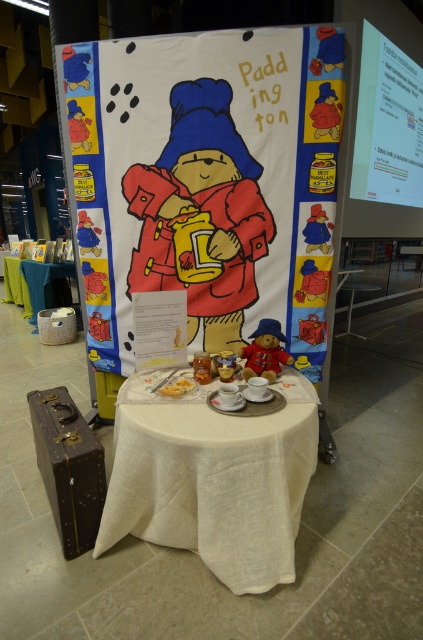
Question: Which of the following is the closest to the observer?

Choices:
 (A) (96, 138)
 (B) (82, 472)

Answer: (B)

Question: Can you confirm if leather suitcase at lower left is bigger than yellow matte cake at center?

Choices:
 (A) no
 (B) yes

Answer: (B)

Question: Which of the following is the closest to the observer?

Choices:
 (A) leather suitcase at lower left
 (B) yellow matte cake at center
 (C) white linen table at center

Answer: (C)

Question: Considering the relative positions of white linen table at center and leather suitcase at lower left in the image provided, where is white linen table at center located with respect to leather suitcase at lower left?

Choices:
 (A) above
 (B) below

Answer: (A)

Question: Can you confirm if white linen table at center is thinner than white fabric table at lower left?

Choices:
 (A) yes
 (B) no

Answer: (A)

Question: Which object appears closest to the camera in this image?

Choices:
 (A) white fabric table at lower left
 (B) yellow matte cake at center
 (C) matte paper paddington bear poster at center
 (D) white linen table at center

Answer: (D)